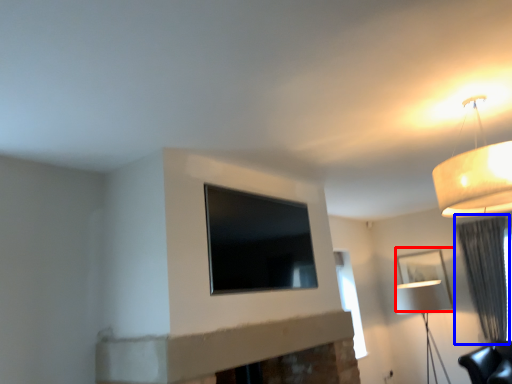
Question: Which object appears farthest to the camera in this image, picture frame (highlighted by a red box) or curtain (highlighted by a blue box)?

Choices:
 (A) picture frame
 (B) curtain

Answer: (A)